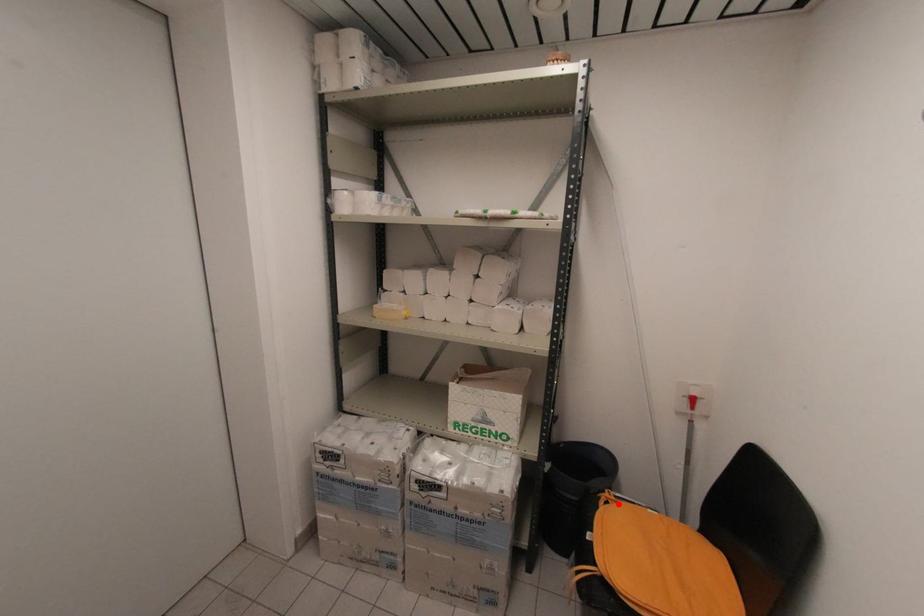
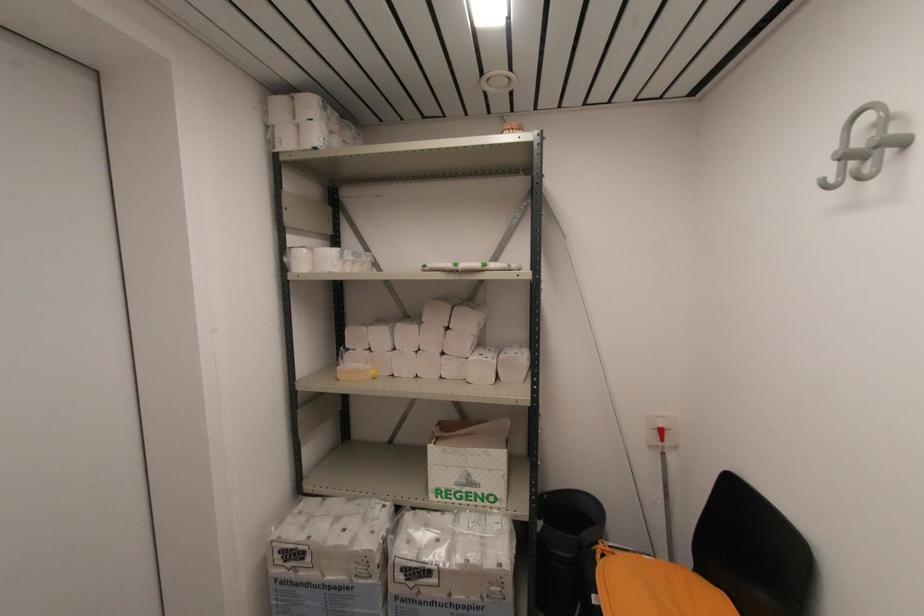
In the second image, find the point that corresponds to the highlighted location in the first image.

(614, 554)